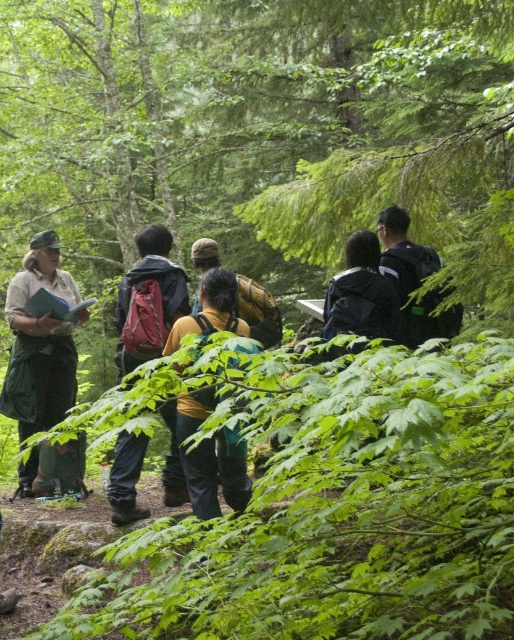
Question: Can you confirm if matte red backpack at center is wider than dark gray backpack at center?

Choices:
 (A) yes
 (B) no

Answer: (A)

Question: Estimate the real-world distances between objects in this image. Which object is closer to the dark gray backpack at center?

Choices:
 (A) matte red backpack at center
 (B) yellow fabric backpack at center

Answer: (A)

Question: Considering the relative positions of yellow fabric backpack at center and dark gray backpack at center in the image provided, where is yellow fabric backpack at center located with respect to dark gray backpack at center?

Choices:
 (A) right
 (B) left

Answer: (B)

Question: Is green uniform at left positioned at the back of yellow fabric backpack at center?

Choices:
 (A) no
 (B) yes

Answer: (B)

Question: Among these objects, which one is farthest from the camera?

Choices:
 (A) dark gray backpack at center
 (B) green uniform at left

Answer: (B)

Question: Which of the following is the closest to the observer?

Choices:
 (A) green uniform at left
 (B) yellow fabric backpack at center
 (C) dark gray backpack at center
 (D) matte red backpack at center

Answer: (B)